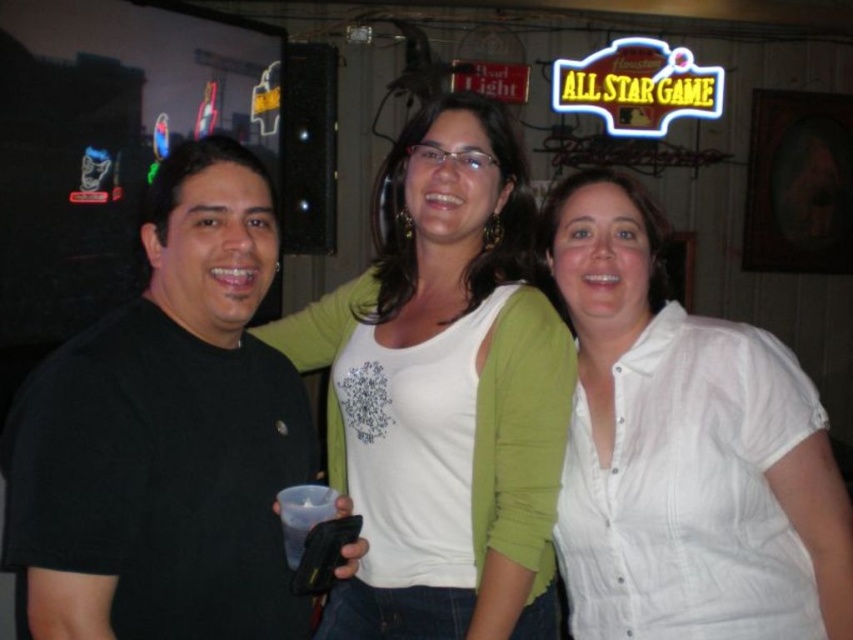
You are organizing a charity clothing drive and need to categorize shirts by size. You have two shirts in front of you labeled as white cotton shirt at center and white matte shirt at center. Which shirt should you place in the small size bin?

The white cotton shirt at center should be placed in the small size bin because it has a smaller size compared to the white matte shirt at center.